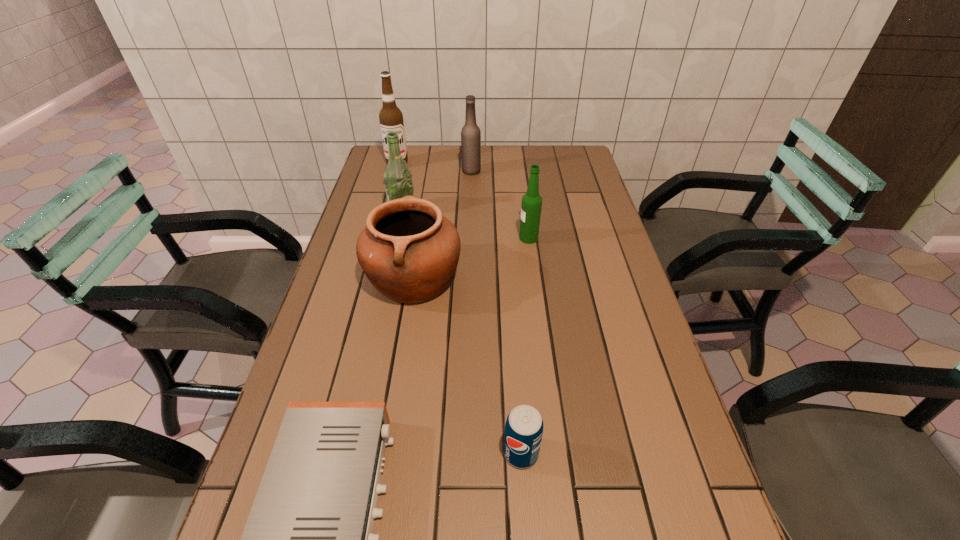
Image resolution: width=960 pixels, height=540 pixels. I want to click on alcohol that is positioned at the left edge, so click(x=391, y=118).

Where is `beer bottle present at the left edge`? beer bottle present at the left edge is located at coordinates (397, 178).

Identify the location of pottery situated at the left edge. (409, 251).

Where is `object present at the far left corner`? The height and width of the screenshot is (540, 960). object present at the far left corner is located at coordinates (391, 118).

At what (x,y) coordinates should I click in order to perform the action: click on free region at the far edge. Please return your answer as a coordinate pair (x, y). This screenshot has width=960, height=540. Looking at the image, I should click on (425, 176).

Where is `free space at the left edge`? The height and width of the screenshot is (540, 960). free space at the left edge is located at coordinates (356, 376).

Where is `vacant region at the right edge of the desktop`? The image size is (960, 540). vacant region at the right edge of the desktop is located at coordinates (635, 397).

I want to click on blank area at the far right corner, so click(583, 155).

What are the coordinates of `free point between the fifth tallest object and the fourth nearest object` in the screenshot? It's located at (471, 258).

In order to click on vacant region between the fifth nearest object and the rightmost object in this screenshot , I will do `click(466, 224)`.